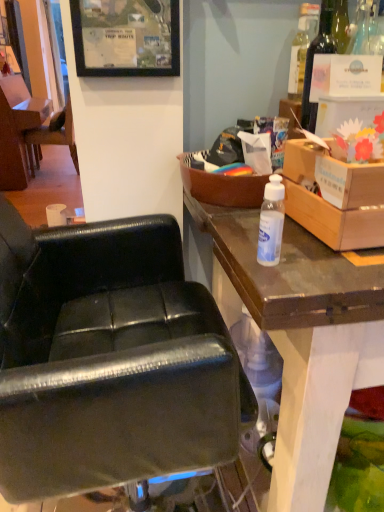
Locate an element on the screen. This screenshot has height=512, width=384. transparent plastic bottle at center, the first bottle in the front-to-back sequence is located at coordinates (271, 222).

Image resolution: width=384 pixels, height=512 pixels. What are the coordinates of `brown wooden box at upper right, which is the 2th box in right-to-left order` in the screenshot? It's located at (221, 186).

In order to face brown wooden box at upper right, which is the first box in left-to-right order, should I rotate leftwards or rightwards?

You should rotate right by 5.700 degrees.

This screenshot has height=512, width=384. What do you see at coordinates (11, 150) in the screenshot?
I see `black leather chair at left, which is the second chair in right-to-left order` at bounding box center [11, 150].

Where is `transparent plastic bottle at center, the second bottle viewed from the right`? This screenshot has height=512, width=384. transparent plastic bottle at center, the second bottle viewed from the right is located at coordinates (271, 222).

Can you confirm if transparent plastic bottle at center, the 2th bottle positioned from the top, is smaller than cardboard box at upper right, the second box from the left?

Yes, transparent plastic bottle at center, the 2th bottle positioned from the top, is smaller than cardboard box at upper right, the second box from the left.

From a real-world perspective, is transparent plastic bottle at center, which is counted as the second bottle, starting from the back, above or below cardboard box at upper right, the second box from the left?

From a real-world perspective, transparent plastic bottle at center, which is counted as the second bottle, starting from the back, is physically below cardboard box at upper right, the second box from the left.

Is transparent plastic bottle at center, the first bottle in the front-to-back sequence, outside of cardboard box at upper right, the second box from the left?

transparent plastic bottle at center, the first bottle in the front-to-back sequence, is positioned outside cardboard box at upper right, the second box from the left.

Is transparent plastic bottle at center, the second bottle viewed from the right, beside cardboard box at upper right, the second box from the left?

No, transparent plastic bottle at center, the second bottle viewed from the right, is not making contact with cardboard box at upper right, the second box from the left.

Considering their positions, is black leather chair at left, the second chair when ordered from front to back, located in front of or behind translucent plastic bottle at upper right, the second bottle ordered from the bottom?

In the image, black leather chair at left, the second chair when ordered from front to back, appears behind translucent plastic bottle at upper right, the second bottle ordered from the bottom.

From the image's perspective, which object appears higher, black leather chair at left, which appears as the first chair when viewed from the left, or translucent plastic bottle at upper right, which is the 1th bottle from top to bottom?

black leather chair at left, which appears as the first chair when viewed from the left, from the image's perspective.

Is black leather chair at left, the second chair when ordered from front to back, oriented away from translucent plastic bottle at upper right, acting as the 2th bottle starting from the front?

That's not correct — black leather chair at left, the second chair when ordered from front to back, is not looking away from translucent plastic bottle at upper right, acting as the 2th bottle starting from the front.

Does black leather chair at left, the second chair when ordered from front to back, have a greater width compared to translucent plastic bottle at upper right, the first bottle in the right-to-left sequence?

Yes, black leather chair at left, the second chair when ordered from front to back, is wider than translucent plastic bottle at upper right, the first bottle in the right-to-left sequence.

Would you say black leather chair at left, the first chair when ordered from top to bottom, is outside cardboard box at upper right, the first box positioned from the right?

Yes, black leather chair at left, the first chair when ordered from top to bottom, is outside of cardboard box at upper right, the first box positioned from the right.

Is black leather chair at left, which is counted as the 1th chair, starting from the back, not near cardboard box at upper right, the second box from the left?

Yes, black leather chair at left, which is counted as the 1th chair, starting from the back, and cardboard box at upper right, the second box from the left, are quite far apart.

Considering the sizes of black leather chair at left, the first chair when ordered from top to bottom, and cardboard box at upper right, the second box from the left, in the image, is black leather chair at left, the first chair when ordered from top to bottom, bigger or smaller than cardboard box at upper right, the second box from the left,?

In the image, black leather chair at left, the first chair when ordered from top to bottom, appears to be larger than cardboard box at upper right, the second box from the left.

From the image's perspective, between black leather chair at left, the 2th chair positioned from the bottom, and cardboard box at upper right, the first box positioned from the right, which one is located above?

black leather chair at left, the 2th chair positioned from the bottom, is shown above in the image.

Considering the sizes of transparent plastic bottle at center, which ranks as the 1th bottle in left-to-right order, and black leather chair at center, the 2th chair from the back, in the image, is transparent plastic bottle at center, which ranks as the 1th bottle in left-to-right order, taller or shorter than black leather chair at center, the 2th chair from the back,?

Considering their sizes, transparent plastic bottle at center, which ranks as the 1th bottle in left-to-right order, has less height than black leather chair at center, the 2th chair from the back.

Is transparent plastic bottle at center, which ranks as the 1th bottle in left-to-right order, wider or thinner than black leather chair at center, positioned as the 1th chair in front-to-back order?

In the image, transparent plastic bottle at center, which ranks as the 1th bottle in left-to-right order, appears to be more narrow than black leather chair at center, positioned as the 1th chair in front-to-back order.

Would you say transparent plastic bottle at center, the 2th bottle positioned from the top, is a long distance from black leather chair at center, positioned as the 1th chair in front-to-back order?

transparent plastic bottle at center, the 2th bottle positioned from the top, is near black leather chair at center, positioned as the 1th chair in front-to-back order, not far away.

From a real-world perspective, is black leather chair at center, positioned as the 1th chair in front-to-back order, on top of brown wooden box at upper right, which is the 2th box in right-to-left order?

No, from a real-world perspective, black leather chair at center, positioned as the 1th chair in front-to-back order, is not over brown wooden box at upper right, which is the 2th box in right-to-left order

Is black leather chair at center, positioned as the 1th chair in front-to-back order, placed right next to brown wooden box at upper right, which is the first box in left-to-right order?

black leather chair at center, positioned as the 1th chair in front-to-back order, and brown wooden box at upper right, which is the first box in left-to-right order, are clearly separated.

Is black leather chair at center, the second chair when ordered from top to bottom, positioned with its back to brown wooden box at upper right, which is the 2th box in right-to-left order?

No.

How many degrees apart are the facing directions of black leather chair at center, the 2th chair from the back, and transparent plastic bottle at center, the second bottle viewed from the right?

There is a 0.00505-degree angle between the facing directions of black leather chair at center, the 2th chair from the back, and transparent plastic bottle at center, the second bottle viewed from the right.

Which object is closer to the camera, black leather chair at center, the 2th chair from the back, or transparent plastic bottle at center, which is counted as the second bottle, starting from the back?

black leather chair at center, the 2th chair from the back, is more forward.

Identify the location of the 1st bottle counting from the right side of the black leather chair at center, placed as the first chair when sorted from right to left. (271, 222).

Based on the photo, which is correct: black leather chair at center, which is the first chair from bottom to top, is inside transparent plastic bottle at center, the first bottle in the front-to-back sequence, or outside of it?

The correct answer is: outside.

What's the angular difference between brown wooden box at upper right, which is the first box in left-to-right order, and black leather chair at center, placed as the first chair when sorted from right to left,'s facing directions?

The angle between the facing direction of brown wooden box at upper right, which is the first box in left-to-right order, and the facing direction of black leather chair at center, placed as the first chair when sorted from right to left, is 0.000543 degrees.

Is the surface of brown wooden box at upper right, which is the 2th box in right-to-left order, in direct contact with black leather chair at center, positioned as the 1th chair in front-to-back order?

No, brown wooden box at upper right, which is the 2th box in right-to-left order, is not making contact with black leather chair at center, positioned as the 1th chair in front-to-back order.

Does brown wooden box at upper right, which is the 2th box in right-to-left order, have a larger size compared to black leather chair at center, the second chair when ordered from top to bottom?

Actually, brown wooden box at upper right, which is the 2th box in right-to-left order, might be smaller than black leather chair at center, the second chair when ordered from top to bottom.

Can you confirm if brown wooden box at upper right, which is the first box in left-to-right order, is thinner than black leather chair at center, positioned as the 1th chair in front-to-back order?

Yes, brown wooden box at upper right, which is the first box in left-to-right order, is thinner than black leather chair at center, positioned as the 1th chair in front-to-back order.

I want to click on bottle below the cardboard box at upper right, the first box positioned from the right (from the image's perspective), so click(x=271, y=222).

Identify the location of the 1st bottle in front of the black leather chair at left, the second chair when ordered from front to back. The height and width of the screenshot is (512, 384). (312, 62).

Based on their spatial positions, is brown wooden box at upper right, which is the first box in left-to-right order, or black leather chair at center, the 2th chair from the back, closer to translucent plastic bottle at upper right, the second bottle from the left?

brown wooden box at upper right, which is the first box in left-to-right order, lies closer to translucent plastic bottle at upper right, the second bottle from the left, than the other object.

Looking at the image, which one is located further to black leather chair at left, which is counted as the 1th chair, starting from the back, transparent plastic bottle at center, the 2th bottle positioned from the top, or black leather chair at center, the 2th chair from the back?

Based on the image, transparent plastic bottle at center, the 2th bottle positioned from the top, appears to be further to black leather chair at left, which is counted as the 1th chair, starting from the back.

When comparing their distances from black leather chair at left, which is counted as the 1th chair, starting from the back, does translucent plastic bottle at upper right, the second bottle from the left, or black leather chair at center, which is the first chair from bottom to top, seem further?

Among the two, translucent plastic bottle at upper right, the second bottle from the left, is located further to black leather chair at left, which is counted as the 1th chair, starting from the back.

Considering their positions, is transparent plastic bottle at center, which ranks as the 1th bottle in left-to-right order, positioned further to cardboard box at upper right, the second box from the left, than black matte picture frame at upper center?

black matte picture frame at upper center is positioned further to the anchor cardboard box at upper right, the second box from the left.

Looking at this image, when comparing their distances from black leather chair at center, placed as the first chair when sorted from right to left, does transparent plastic bottle at center, the first bottle in the front-to-back sequence, or black matte picture frame at upper center seem closer?

transparent plastic bottle at center, the first bottle in the front-to-back sequence, is positioned closer to the anchor black leather chair at center, placed as the first chair when sorted from right to left.

Based on their spatial positions, is brown wooden box at upper right, which is the first box in left-to-right order, or black leather chair at center, the 2th chair from the back, closer to transparent plastic bottle at center, the second bottle viewed from the right?

brown wooden box at upper right, which is the first box in left-to-right order.

Based on their spatial positions, is cardboard box at upper right, the second box from the left, or transparent plastic bottle at center, the first bottle in the front-to-back sequence, closer to brown wooden box at upper right, which is the first box in left-to-right order?

Among the two, cardboard box at upper right, the second box from the left, is located nearer to brown wooden box at upper right, which is the first box in left-to-right order.

Based on the photo, from the image, which object appears to be nearer to black matte picture frame at upper center, translucent plastic bottle at upper right, acting as the 1th bottle starting from the back, or black leather chair at left, the 2th chair positioned from the bottom?

Among the two, translucent plastic bottle at upper right, acting as the 1th bottle starting from the back, is located nearer to black matte picture frame at upper center.

Where is `box located between cardboard box at upper right, the first box positioned from the right, and black leather chair at left, which is the second chair in right-to-left order, in the depth direction`? Image resolution: width=384 pixels, height=512 pixels. box located between cardboard box at upper right, the first box positioned from the right, and black leather chair at left, which is the second chair in right-to-left order, in the depth direction is located at coordinates (221, 186).

I want to click on bottle between cardboard box at upper right, the first box positioned from the right, and black leather chair at left, the second chair when ordered from front to back, in the front-back direction, so click(312, 62).

Locate an element on the screen. The width and height of the screenshot is (384, 512). box between black matte picture frame at upper center and translucent plastic bottle at upper right, acting as the 1th bottle starting from the back is located at coordinates pos(221,186).

I want to click on box positioned between transparent plastic bottle at center, which ranks as the 1th bottle in left-to-right order, and brown wooden box at upper right, which is the 2th box in right-to-left order, from near to far, so click(334, 175).